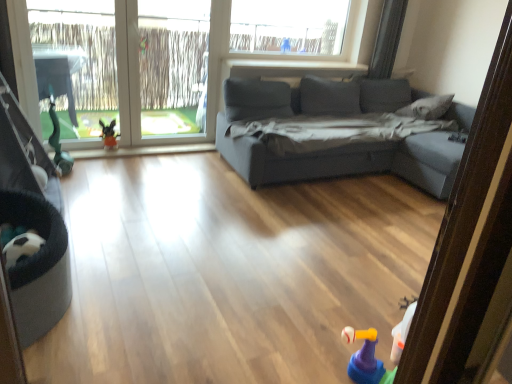
What do you see at coordinates (173, 67) in the screenshot? Image resolution: width=512 pixels, height=384 pixels. I see `transparent plastic window screen at upper center` at bounding box center [173, 67].

This screenshot has height=384, width=512. What do you see at coordinates (426, 107) in the screenshot?
I see `gray fabric pillow at upper right` at bounding box center [426, 107].

The height and width of the screenshot is (384, 512). What do you see at coordinates (109, 135) in the screenshot? I see `plush toy at lower left` at bounding box center [109, 135].

Measure the distance between black fabric baby carriage at lower left and camera.

black fabric baby carriage at lower left and camera are 5.63 feet apart.

Find the location of a particular element. The image size is (512, 384). rubberized yellow and purple toy at lower right is located at coordinates (366, 359).

Locate an element on the screen. This screenshot has height=384, width=512. window above the rubberized yellow and purple toy at lower right (from a real-world perspective) is located at coordinates tap(228, 63).

Is rubberized yellow and purple toy at lower right facing towards clear glass window at left?

No, rubberized yellow and purple toy at lower right is not facing towards clear glass window at left.

Is rubberized yellow and purple toy at lower right smaller than clear glass window at left?

Correct, rubberized yellow and purple toy at lower right occupies less space than clear glass window at left.

In the scene shown: Considering the sizes of objects rubberized yellow and purple toy at lower right and clear glass window at left in the image provided, who is shorter, rubberized yellow and purple toy at lower right or clear glass window at left?

rubberized yellow and purple toy at lower right.

Can you see gray fabric pillow at upper right touching black fabric baby carriage at lower left?

They are not placed beside each other.

Identify the location of baby carriage on the left side of gray fabric pillow at upper right. (33, 224).

Considering the sizes of objects gray fabric pillow at upper right and black fabric baby carriage at lower left in the image provided, who is shorter, gray fabric pillow at upper right or black fabric baby carriage at lower left?

With less height is gray fabric pillow at upper right.

Does point (411, 106) come in front of point (16, 168)?

That is False.

Are gray fabric pillow at upper right and transparent plastic window screen at upper center located far from each other?

Yes, gray fabric pillow at upper right and transparent plastic window screen at upper center are located far from each other.

How distant is gray fabric pillow at upper right from transparent plastic window screen at upper center?

They are 2.53 meters apart.

Identify the location of pillow below the transparent plastic window screen at upper center (from the image's perspective). This screenshot has height=384, width=512. (426, 107).

Looking at the image, does gray fabric pillow at upper right seem bigger or smaller compared to transparent plastic window screen at upper center?

In the image, gray fabric pillow at upper right appears to be smaller than transparent plastic window screen at upper center.

Identify the location of baby carriage on the left of the gray fabric pillow at upper right. (33, 224).

Considering the positions of objects black fabric baby carriage at lower left and gray fabric pillow at upper right in the image provided, who is in front, black fabric baby carriage at lower left or gray fabric pillow at upper right?

black fabric baby carriage at lower left is in front.

Considering the sizes of objects black fabric baby carriage at lower left and gray fabric pillow at upper right in the image provided, who is wider, black fabric baby carriage at lower left or gray fabric pillow at upper right?

With larger width is gray fabric pillow at upper right.

From the image's perspective, which one is positioned lower, plush toy at lower left or clear glass window at left?

plush toy at lower left is shown below in the image.

Image resolution: width=512 pixels, height=384 pixels. In order to click on toddler behind the clear glass window at left in this screenshot , I will do `click(109, 135)`.

Who is more distant, plush toy at lower left or clear glass window at left?

plush toy at lower left.

Considering the sizes of objects plush toy at lower left and clear glass window at left in the image provided, who is wider, plush toy at lower left or clear glass window at left?

plush toy at lower left is wider.

Is clear glass window at left facing towards rubberized yellow and purple toy at lower right?

Yes, clear glass window at left is aimed at rubberized yellow and purple toy at lower right.

Is clear glass window at left not within rubberized yellow and purple toy at lower right?

Indeed, clear glass window at left is completely outside rubberized yellow and purple toy at lower right.

Which of these two, clear glass window at left or rubberized yellow and purple toy at lower right, stands taller?

clear glass window at left is taller.

Is transparent plastic window screen at upper center located outside clear glass window at left?

No, transparent plastic window screen at upper center is inside or overlapping with clear glass window at left.

Could you tell me if transparent plastic window screen at upper center is turned towards clear glass window at left?

Yes, transparent plastic window screen at upper center is oriented towards clear glass window at left.

You are a GUI agent. You are given a task and a screenshot of the screen. Output one action in this format:
    pyautogui.click(x=<x>, y=<y>)
    Task: Click on the toy below the clear glass window at left (from a real-world perspective)
    
    Given the screenshot: What is the action you would take?
    pyautogui.click(x=366, y=359)

Where is `baby carriage in front of the gray fabric pillow at upper right`? This screenshot has height=384, width=512. baby carriage in front of the gray fabric pillow at upper right is located at coordinates (33, 224).

Which object lies further to the anchor point plush toy at lower left, rubberized yellow and purple toy at lower right or clear glass window at left?

rubberized yellow and purple toy at lower right lies further to plush toy at lower left than the other object.

Estimate the real-world distances between objects in this image. Which object is further from rubberized yellow and purple toy at lower right, gray fabric pillow at upper right or black fabric baby carriage at lower left?

Based on the image, gray fabric pillow at upper right appears to be further to rubberized yellow and purple toy at lower right.

Estimate the real-world distances between objects in this image. Which object is further from rubberized yellow and purple toy at lower right, transparent plastic window screen at upper center or gray fabric pillow at upper right?

The object further to rubberized yellow and purple toy at lower right is transparent plastic window screen at upper center.

Based on their spatial positions, is gray fabric pillow at upper right or transparent plastic window screen at upper center closer to rubberized yellow and purple toy at lower right?

Based on the image, gray fabric pillow at upper right appears to be nearer to rubberized yellow and purple toy at lower right.

Considering their positions, is rubberized yellow and purple toy at lower right positioned closer to gray fabric pillow at upper right than clear glass window at left?

Among the two, clear glass window at left is located nearer to gray fabric pillow at upper right.

Looking at the image, which one is located closer to clear glass window at left, black fabric baby carriage at lower left or rubberized yellow and purple toy at lower right?

black fabric baby carriage at lower left.

Considering their positions, is clear glass window at left positioned closer to plush toy at lower left than rubberized yellow and purple toy at lower right?

clear glass window at left is positioned closer to the anchor plush toy at lower left.

Based on the photo, when comparing their distances from black fabric baby carriage at lower left, does gray fabric pillow at upper right or rubberized yellow and purple toy at lower right seem further?

gray fabric pillow at upper right is further to black fabric baby carriage at lower left.

Locate an element on the screen. This screenshot has height=384, width=512. window between black fabric baby carriage at lower left and transparent plastic window screen at upper center along the z-axis is located at coordinates [228, 63].

This screenshot has width=512, height=384. Identify the location of baby carriage between plush toy at lower left and gray fabric pillow at upper right from left to right. (33, 224).

At what (x,y) coordinates should I click in order to perform the action: click on toy located between black fabric baby carriage at lower left and transparent plastic window screen at upper center in the depth direction. Please return your answer as a coordinate pair (x, y). The image size is (512, 384). Looking at the image, I should click on pyautogui.click(x=366, y=359).

I want to click on window screen located between black fabric baby carriage at lower left and gray fabric pillow at upper right in the left-right direction, so click(173, 67).